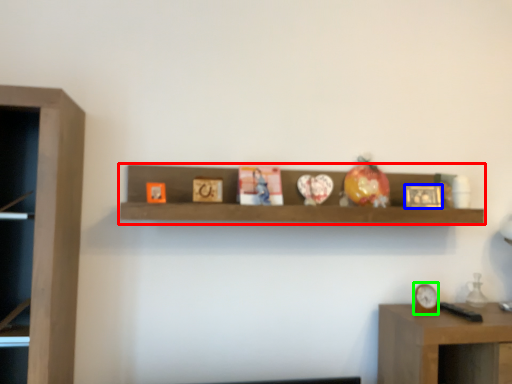
Question: Considering the real-world distances, which object is farthest from shelf (highlighted by a red box)? picture frame (highlighted by a blue box) or clock (highlighted by a green box)?

Choices:
 (A) picture frame
 (B) clock

Answer: (B)